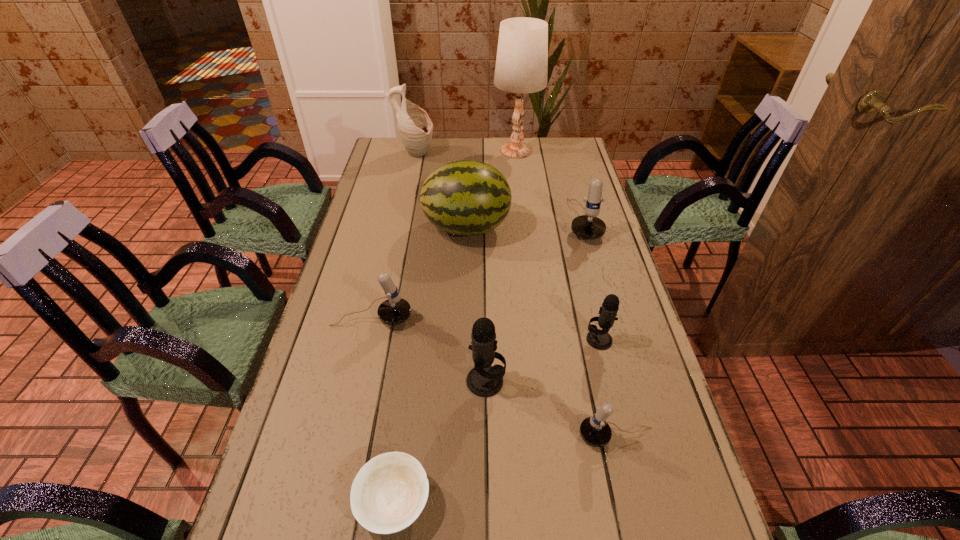
Where is `vacant position located 0.060m on the left of the second shortest object`? The height and width of the screenshot is (540, 960). vacant position located 0.060m on the left of the second shortest object is located at coordinates (551, 436).

You are a GUI agent. You are given a task and a screenshot of the screen. Output one action in this format:
    pyautogui.click(x=<x>, y=<y>)
    Task: Click on the lamp that is at the far edge
    This screenshot has height=540, width=960.
    Given the screenshot: What is the action you would take?
    pyautogui.click(x=521, y=67)

Identify the location of pitcher at the far edge. The width and height of the screenshot is (960, 540). [x=415, y=128].

Locate an element on the screen. The image size is (960, 540). pitcher present at the left edge is located at coordinates (415, 128).

This screenshot has width=960, height=540. I want to click on microphone that is at the left edge, so click(395, 310).

Identify the location of object that is positioned at the far left corner. (415, 128).

This screenshot has width=960, height=540. In the image, there is a desktop. In order to click on blank space at the far edge in this screenshot , I will do `click(463, 158)`.

The image size is (960, 540). In the image, there is a desktop. What are the coordinates of `vacant space at the left edge` in the screenshot? It's located at click(x=359, y=213).

The width and height of the screenshot is (960, 540). Find the location of `free region at the right edge of the desktop`. free region at the right edge of the desktop is located at coordinates (564, 226).

In the image, there is a desktop. In order to click on free space at the far left corner in this screenshot , I will do `click(395, 145)`.